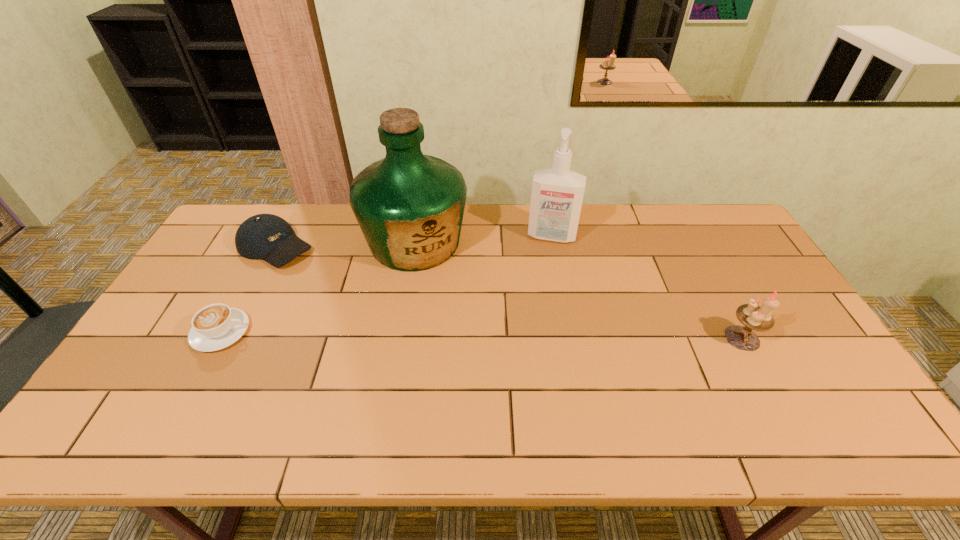
This screenshot has height=540, width=960. I want to click on the shortest object, so click(x=216, y=326).

Where is `the rightmost object`? Image resolution: width=960 pixels, height=540 pixels. the rightmost object is located at coordinates (753, 317).

Where is `the third shortest object`? Image resolution: width=960 pixels, height=540 pixels. the third shortest object is located at coordinates (753, 317).

Where is `the third object from right to left`? This screenshot has height=540, width=960. the third object from right to left is located at coordinates (409, 206).

Where is `the second object from right to left`? Image resolution: width=960 pixels, height=540 pixels. the second object from right to left is located at coordinates (557, 194).

What are the coordinates of `the second tallest object` in the screenshot? It's located at (557, 194).

You are a GUI agent. You are given a task and a screenshot of the screen. Output one action in this format:
    pyautogui.click(x=<x>, y=<y>)
    Task: Click on the fourth tallest object
    Image resolution: width=960 pixels, height=540 pixels.
    Given the screenshot: What is the action you would take?
    pyautogui.click(x=268, y=237)

Identify the location of vacant space situated on the side of the cappuccino with the handle. The width and height of the screenshot is (960, 540). (377, 332).

Identify the location of vacant area situated on the left of the third shortest object. The image size is (960, 540). (655, 338).

Identify the location of free spot located 0.130m on the label side of the third object from right to left. The image size is (960, 540). (443, 306).